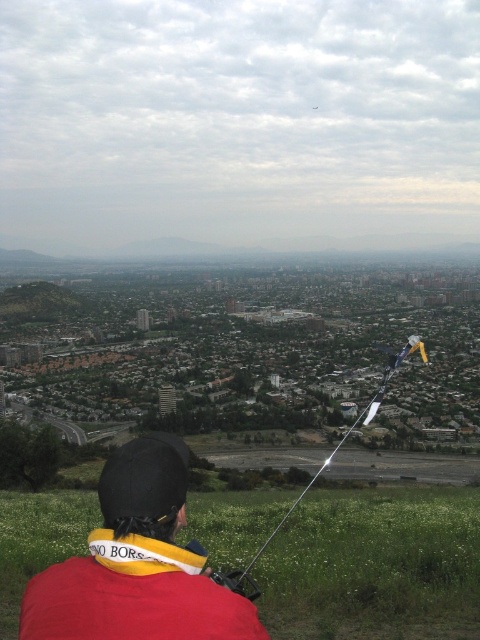
You are standing at the vantage point looking down at the scene. Which object is closer to you between the green grassy field at lower center and the red fabric jacket at lower center?

The red fabric jacket at lower center is closer to you because it is in front of the green grassy field at lower center.

You are standing at the vantage point overlooking the urban landscape. You notice the red fabric jacket at lower center and the metallic silver string at lower center. Which object is closer to you?

The red fabric jacket at lower center is closer to the viewer than the metallic silver string at lower center.